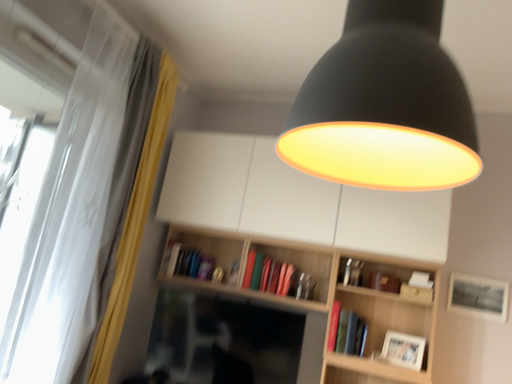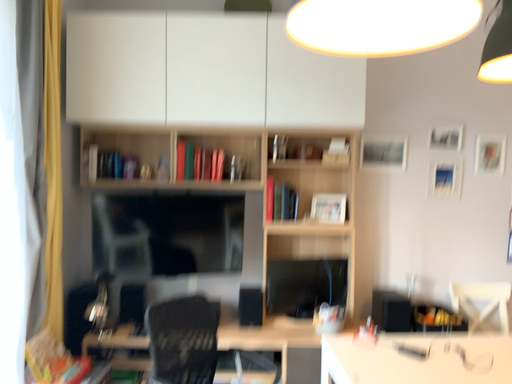
Question: How did the camera likely rotate when shooting the video?

Choices:
 (A) rotated downward
 (B) rotated upward

Answer: (A)